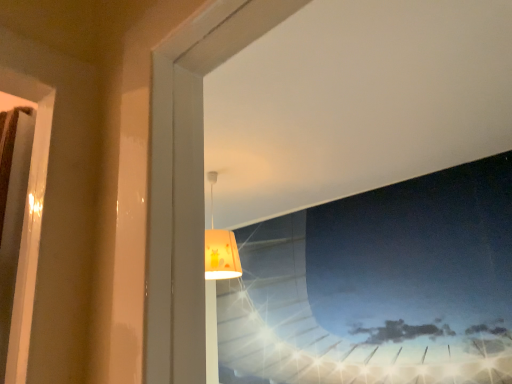
Identify the location of transparent glass airplane window at upper center. The image size is (512, 384). (379, 285).

What do you see at coordinates (379, 285) in the screenshot? I see `transparent glass airplane window at upper center` at bounding box center [379, 285].

At what (x,y) coordinates should I click in order to perform the action: click on transparent glass airplane window at upper center. Please return your answer as a coordinate pair (x, y). Image resolution: width=512 pixels, height=384 pixels. Looking at the image, I should click on click(x=379, y=285).